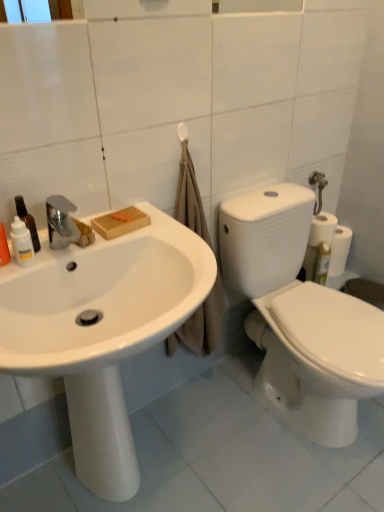
This screenshot has width=384, height=512. Describe the element at coordinates (4, 247) in the screenshot. I see `translucent plastic spray bottle at left, which is counted as the 1th cleaning product, starting from the left` at that location.

You are a GUI agent. You are given a task and a screenshot of the screen. Output one action in this format:
    pyautogui.click(x=<x>, y=<y>)
    Task: Click on the white matte toilet paper at right
    
    Given the screenshot: What is the action you would take?
    pyautogui.click(x=322, y=229)

What do you see at coordinates (27, 221) in the screenshot? I see `translucent plastic bottle at left, which ranks as the second cleaning product in left-to-right order` at bounding box center [27, 221].

At what (x,y) coordinates should I click in order to perform the action: click on white glossy bottle at left. Please return your answer as a coordinate pair (x, y). This screenshot has height=512, width=384. Looking at the image, I should click on (22, 243).

The image size is (384, 512). I want to click on translucent plastic spray bottle at left, which is counted as the 1th cleaning product, starting from the left, so click(4, 247).

From the image's perspective, is white glossy sink at left located above or below white matte towel bar at upper center?

white glossy sink at left is below white matte towel bar at upper center.

From a real-world perspective, is white glossy sink at left above or below white matte towel bar at upper center?

From a real-world perspective, white glossy sink at left is physically below white matte towel bar at upper center.

Locate an element on the screen. sink below the white matte towel bar at upper center (from the image's perspective) is located at coordinates pyautogui.click(x=102, y=330).

Considering the positions of point (71, 254) and point (180, 134), is point (71, 254) closer or farther from the camera than point (180, 134)?

Point (71, 254).

Could you tell me if translucent plastic bottle at left, positioned as the first cleaning product in right-to-left order, is turned towards white glossy bottle at left?

No, translucent plastic bottle at left, positioned as the first cleaning product in right-to-left order, is not aimed at white glossy bottle at left.

Which of these two, translucent plastic bottle at left, positioned as the first cleaning product in right-to-left order, or white glossy bottle at left, is wider?

Wider between the two is translucent plastic bottle at left, positioned as the first cleaning product in right-to-left order.

Based on the photo, is translucent plastic bottle at left, positioned as the first cleaning product in right-to-left order, at the right side of white glossy bottle at left?

No.

From the image's perspective, which one is positioned lower, translucent plastic bottle at left, positioned as the first cleaning product in right-to-left order, or white glossy bottle at left?

white glossy bottle at left appears lower in the image.

How many degrees apart are the facing directions of translucent plastic bottle at left, positioned as the first cleaning product in right-to-left order, and translucent plastic spray bottle at left, which is counted as the 1th cleaning product, starting from the left?

0.000181 degrees.

Is translucent plastic bottle at left, which ranks as the second cleaning product in left-to-right order, inside the boundaries of translucent plastic spray bottle at left, which appears as the second cleaning product when viewed from the right, or outside?

translucent plastic bottle at left, which ranks as the second cleaning product in left-to-right order, is outside translucent plastic spray bottle at left, which appears as the second cleaning product when viewed from the right.

Is translucent plastic bottle at left, which ranks as the second cleaning product in left-to-right order, wider than translucent plastic spray bottle at left, which is counted as the 1th cleaning product, starting from the left?

Correct, the width of translucent plastic bottle at left, which ranks as the second cleaning product in left-to-right order, exceeds that of translucent plastic spray bottle at left, which is counted as the 1th cleaning product, starting from the left.

Is the position of white matte towel bar at upper center less distant than that of white matte toilet paper at right?

That is True.

Is white matte towel bar at upper center shorter than white matte toilet paper at right?

Indeed, white matte towel bar at upper center has a lesser height compared to white matte toilet paper at right.

Is white matte towel bar at upper center bigger than white matte toilet paper at right?

No, white matte towel bar at upper center is not bigger than white matte toilet paper at right.

Could you tell me if white matte toilet paper at right is facing white glossy bottle at left?

No, white matte toilet paper at right is not aimed at white glossy bottle at left.

From a real-world perspective, is white matte toilet paper at right positioned under white glossy bottle at left based on gravity?

Yes, from a real-world perspective, white matte toilet paper at right is beneath white glossy bottle at left.

Consider the image. Does white matte toilet paper at right have a larger size compared to white glossy bottle at left?

Yes.

From a real-world perspective, who is located higher, translucent plastic bottle at left, positioned as the first cleaning product in right-to-left order, or white glossy sink at left?

translucent plastic bottle at left, positioned as the first cleaning product in right-to-left order, from a real-world perspective.

Where is `the 1st cleaning product to the left when counting from the white glossy sink at left`? The width and height of the screenshot is (384, 512). the 1st cleaning product to the left when counting from the white glossy sink at left is located at coordinates (27, 221).

Who is more distant, translucent plastic bottle at left, which ranks as the second cleaning product in left-to-right order, or white glossy sink at left?

translucent plastic bottle at left, which ranks as the second cleaning product in left-to-right order, is further away from the camera.

From a real-world perspective, between white matte toilet paper at right and white matte towel bar at upper center, who is vertically higher?

In real-world perspective, white matte towel bar at upper center is above.

From the picture: Does white matte toilet paper at right have a smaller size compared to white matte towel bar at upper center?

Incorrect, white matte toilet paper at right is not smaller in size than white matte towel bar at upper center.

From the image's perspective, between white matte toilet paper at right and white matte towel bar at upper center, who is located below?

From the image's view, white matte toilet paper at right is below.

What's the angular difference between white matte toilet paper at right and white matte towel bar at upper center's facing directions?

They differ by 2.65 degrees in their facing directions.

You are a GUI agent. You are given a task and a screenshot of the screen. Output one action in this format:
    pyautogui.click(x=<x>, y=<y>)
    Task: Click on the sink that appears below the white matte towel bar at upper center (from the image's perspective)
    The width and height of the screenshot is (384, 512).
    Given the screenshot: What is the action you would take?
    pyautogui.click(x=102, y=330)

This screenshot has width=384, height=512. I want to click on toiletry that appears on the right of translucent plastic bottle at left, which ranks as the second cleaning product in left-to-right order, so click(x=22, y=243).

Based on their spatial positions, is translucent plastic bottle at left, positioned as the first cleaning product in right-to-left order, or translucent plastic spray bottle at left, which appears as the second cleaning product when viewed from the right, further from white glossy bottle at left?

translucent plastic spray bottle at left, which appears as the second cleaning product when viewed from the right, is positioned further to the anchor white glossy bottle at left.

Which object lies nearer to the anchor point white matte toilet paper at right, white matte towel bar at upper center or white glossy sink at left?

Among the two, white matte towel bar at upper center is located nearer to white matte toilet paper at right.

From the image, which object appears to be nearer to white glossy sink at left, white matte toilet paper at right or translucent plastic spray bottle at left, which is counted as the 1th cleaning product, starting from the left?

translucent plastic spray bottle at left, which is counted as the 1th cleaning product, starting from the left.

From the image, which object appears to be nearer to translucent plastic bottle at left, positioned as the first cleaning product in right-to-left order, white matte towel bar at upper center or white glossy sink at left?

white glossy sink at left is positioned closer to the anchor translucent plastic bottle at left, positioned as the first cleaning product in right-to-left order.

Considering their positions, is white matte towel bar at upper center positioned closer to white glossy sink at left than white matte toilet paper at right?

Among the two, white matte towel bar at upper center is located nearer to white glossy sink at left.

From the image, which object appears to be nearer to translucent plastic spray bottle at left, which is counted as the 1th cleaning product, starting from the left, white glossy bottle at left or white matte towel bar at upper center?

white glossy bottle at left is closer to translucent plastic spray bottle at left, which is counted as the 1th cleaning product, starting from the left.

Looking at the image, which one is located closer to white glossy bottle at left, white matte toilet paper at right or white glossy sink at left?

white glossy sink at left.

Considering their positions, is translucent plastic bottle at left, positioned as the first cleaning product in right-to-left order, positioned further to white glossy sink at left than white matte toilet paper at right?

white matte toilet paper at right is further to white glossy sink at left.

Find the location of a particular element. This screenshot has height=512, width=384. cleaning product situated between translucent plastic spray bottle at left, which is counted as the 1th cleaning product, starting from the left, and white matte toilet paper at right from left to right is located at coordinates (27, 221).

Locate an element on the screen. This screenshot has height=512, width=384. cleaning product situated between translucent plastic spray bottle at left, which is counted as the 1th cleaning product, starting from the left, and white matte towel bar at upper center from left to right is located at coordinates (27, 221).

Where is `towel bar between translucent plastic spray bottle at left, which appears as the second cleaning product when viewed from the right, and white matte toilet paper at right from left to right`? Image resolution: width=384 pixels, height=512 pixels. towel bar between translucent plastic spray bottle at left, which appears as the second cleaning product when viewed from the right, and white matte toilet paper at right from left to right is located at coordinates (182, 132).

Where is `toiletry between translucent plastic spray bottle at left, which appears as the second cleaning product when viewed from the right, and white matte toilet paper at right from left to right`? The height and width of the screenshot is (512, 384). toiletry between translucent plastic spray bottle at left, which appears as the second cleaning product when viewed from the right, and white matte toilet paper at right from left to right is located at coordinates (22, 243).